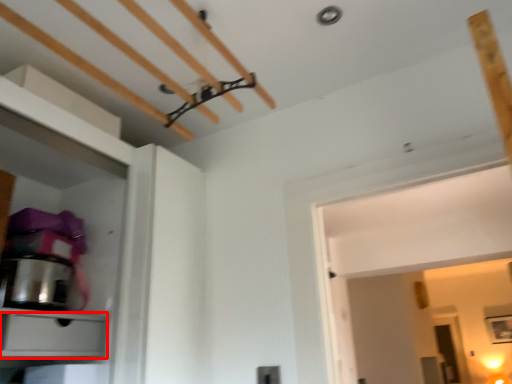
Question: Considering the relative positions of drawer (annotated by the red box) and appliance in the image provided, where is drawer (annotated by the red box) located with respect to the staircase?

Choices:
 (A) right
 (B) left

Answer: (A)